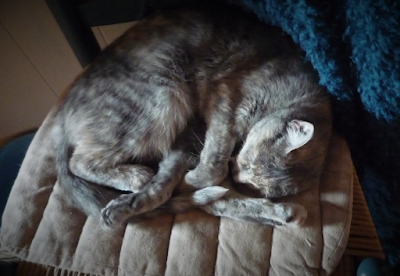
At what (x,y) coordinates should I click in order to perform the action: click on bed. Please return your answer as a coordinate pair (x, y). Looking at the image, I should click on (188, 240).